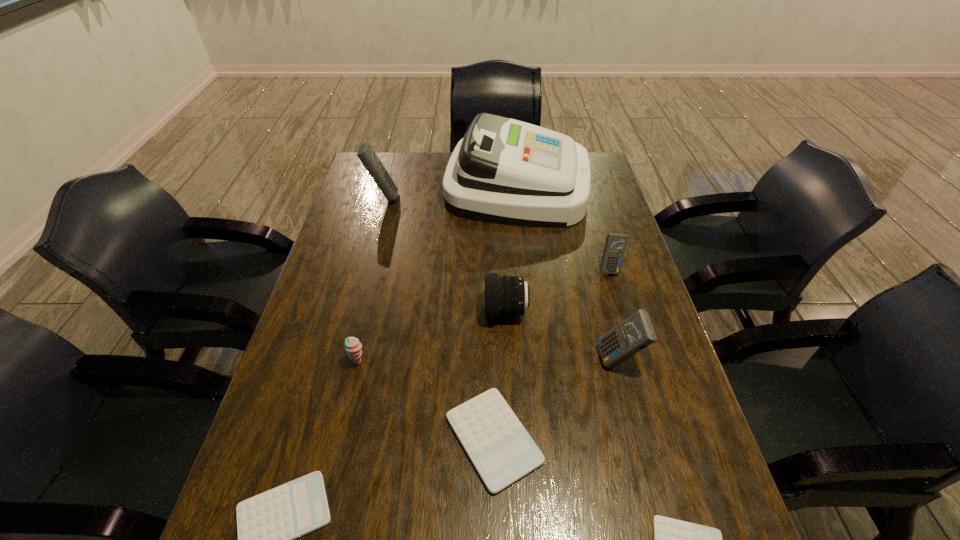
Identify the location of free location at the right edge. The width and height of the screenshot is (960, 540). (604, 202).

Where is `vacant point located between the cash register and the sixth tallest object`? vacant point located between the cash register and the sixth tallest object is located at coordinates pyautogui.click(x=438, y=274).

The image size is (960, 540). I want to click on free space between the tallest calculator and the biggest white calculator, so click(x=439, y=318).

This screenshot has width=960, height=540. Identify the location of free area in between the third farthest calculator and the fourth shortest calculator. (613, 314).

The image size is (960, 540). I want to click on free space between the cash register and the sherbert, so click(x=438, y=274).

Identify the location of object that can be found as the third closest to the fourth shortest object. Image resolution: width=960 pixels, height=540 pixels. (505, 296).

Where is `the sixth closest object to the second white calculator from left to right`? This screenshot has width=960, height=540. the sixth closest object to the second white calculator from left to right is located at coordinates (615, 246).

Select which calculator appears as the second closest to the smallest white calculator. Please provide its 2D coordinates. Your answer should be formatted as a tuple, i.e. [(x, y)], where the tuple contains the x and y coordinates of a point satisfying the conditions above.

[(635, 333)]

At what (x,y) coordinates should I click in order to perform the action: click on calculator object that ranks as the second closest to the sixth nearest object. Please return your answer as a coordinate pair (x, y). The height and width of the screenshot is (540, 960). Looking at the image, I should click on coord(501,450).

This screenshot has height=540, width=960. Identify the location of blue calculator identified as the second closest to the second nearest blue calculator. (366, 154).